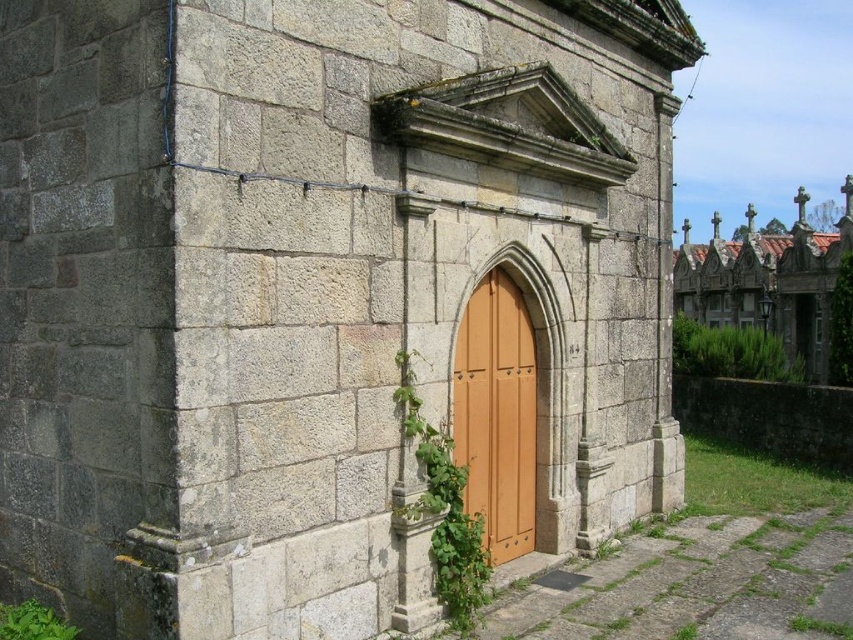
You are standing in front of the stone building and notice two points marked on the wall. One is at coordinate point (x=805, y=225) and the other at point (x=444, y=544). If you were to draw a straight line from your current position to each point, which point would require the line to pass closer to the arched doorway?

Point (x=444, y=544) is closer to the arched doorway because it is in front of point (x=805, y=225). Since the arched doorway is at the front of the building, the line to point (x=444, y=544) would pass closer to it.

In the scene shown: You are an architect examining the stone building. You notice the wooden at center and the green leafy ivy at center. Which one is closer to you?

The wooden at center is closer to you because the green leafy ivy at center is behind it.